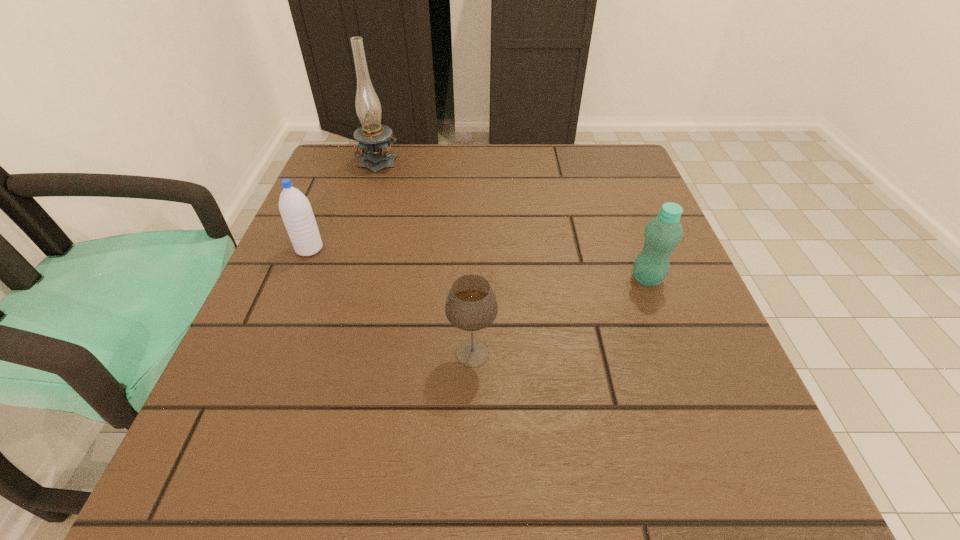
Locate an element on the screen. Image resolution: width=960 pixels, height=540 pixels. free space that is in between the third object from left to right and the third farthest object is located at coordinates (560, 316).

This screenshot has height=540, width=960. I want to click on unoccupied position between the nearest object and the farthest object, so click(x=425, y=256).

Identify the location of unoccupied position between the oil lamp and the nearest object. The image size is (960, 540). pos(425,256).

Where is `free area in between the farther water bottle and the second object from right to left`? free area in between the farther water bottle and the second object from right to left is located at coordinates (391, 301).

Where is `unoccupied area between the third nearest object and the second object from left to right`? unoccupied area between the third nearest object and the second object from left to right is located at coordinates (345, 204).

You are a GUI agent. You are given a task and a screenshot of the screen. Output one action in this format:
    pyautogui.click(x=<x>, y=<y>)
    Task: Click on the vacant area that lies between the wineglass and the left water bottle
    The image size is (960, 540).
    Given the screenshot: What is the action you would take?
    pyautogui.click(x=391, y=301)

Point out which object is positioned as the nearest to the third object from left to right. Please provide its 2D coordinates. Your answer should be formatted as a tuple, i.e. [(x, y)], where the tuple contains the x and y coordinates of a point satisfying the conditions above.

[(663, 233)]

Identify which object is located as the second nearest to the farthest object. Please provide its 2D coordinates. Your answer should be formatted as a tuple, i.e. [(x, y)], where the tuple contains the x and y coordinates of a point satisfying the conditions above.

[(471, 305)]

At what (x,y) coordinates should I click in order to perform the action: click on vacant region that satisfies the following two spatial constraints: 1. on the front side of the oil lamp; 2. on the left side of the nearest object. Please return your answer as a coordinate pair (x, y). The width and height of the screenshot is (960, 540). Looking at the image, I should click on (319, 353).